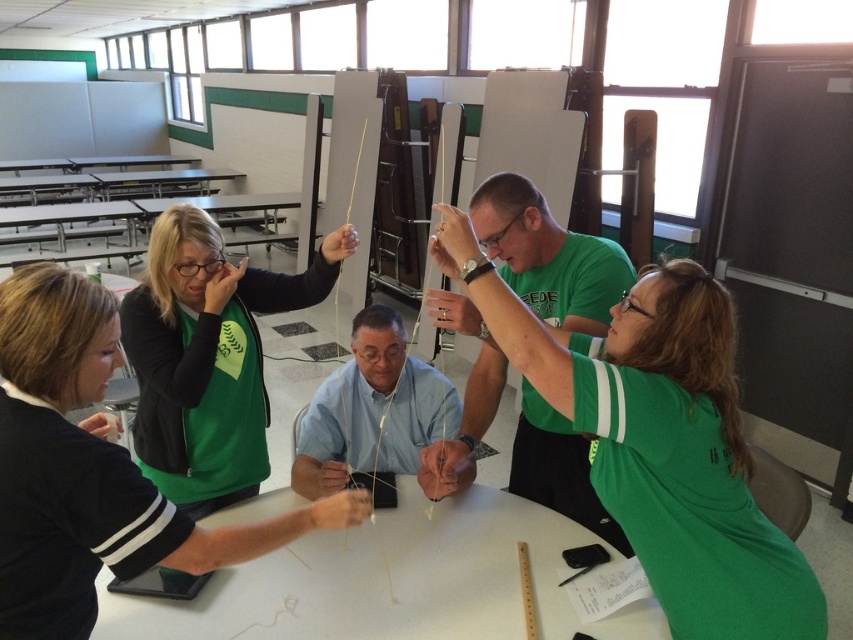
Is green matte shirt at center positioned at the back of blue fabric shirt at center?

That is False.

Is point (529, 456) farther from viewer compared to point (415, 408)?

No, (529, 456) is closer to viewer.

Who is more forward, (584, 326) or (311, 474)?

Point (584, 326) is more forward.

Where is `green matte shirt at center`? The height and width of the screenshot is (640, 853). green matte shirt at center is located at coordinates (548, 257).

Is metallic gray table at upper left wider than black plastic table at upper center?

Correct, the width of metallic gray table at upper left exceeds that of black plastic table at upper center.

This screenshot has height=640, width=853. Identify the location of metallic gray table at upper left. (160, 180).

The image size is (853, 640). What are the coordinates of `metallic gray table at upper left` in the screenshot? It's located at (160, 180).

Locate an element on the screen. green matte shirt at upper right is located at coordinates (659, 440).

Can you confirm if green matte shirt at upper right is positioned to the right of metallic silver table at upper left?

Correct, you'll find green matte shirt at upper right to the right of metallic silver table at upper left.

Does point (741, 621) come behind point (134, 236)?

No, (741, 621) is in front of (134, 236).

The height and width of the screenshot is (640, 853). In order to click on green matte shirt at upper right in this screenshot , I will do `click(659, 440)`.